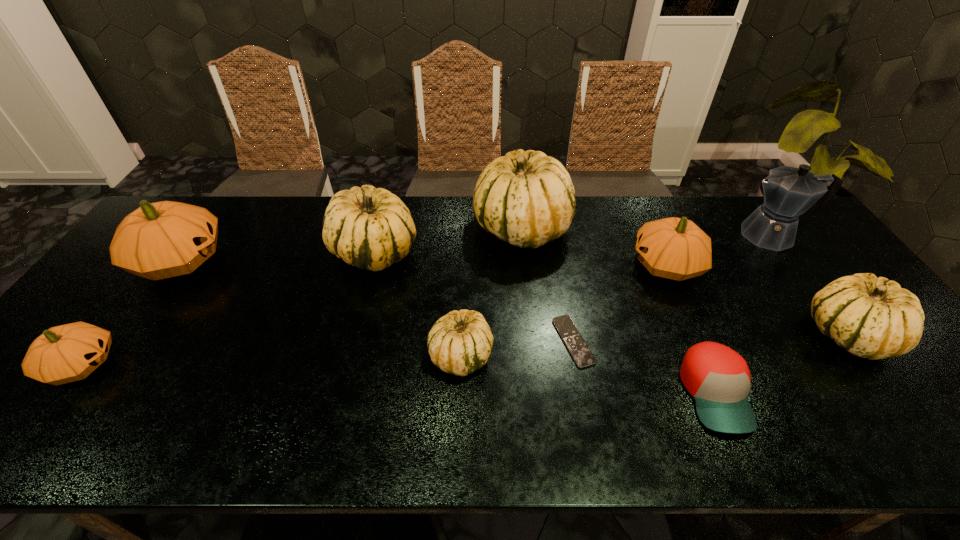
This screenshot has height=540, width=960. I want to click on the smallest white gourd, so point(459,343).

Where is `red baseball cap`? This screenshot has width=960, height=540. red baseball cap is located at coordinates (718, 378).

Locate an element on the screen. The height and width of the screenshot is (540, 960). the ninth tallest object is located at coordinates (718, 378).

The image size is (960, 540). In order to click on the shortest object in this screenshot , I will do `click(580, 352)`.

Find the location of `vacant space located 0.330m on the right of the biggest white gourd`. vacant space located 0.330m on the right of the biggest white gourd is located at coordinates (672, 227).

At what (x,y) coordinates should I click in order to perform the action: click on vacant space located at the spout of the coffeepot. Please return your answer as a coordinate pair (x, y). The image size is (960, 540). Looking at the image, I should click on (701, 235).

Where is `vacant area located at the spout of the coffeepot`? Image resolution: width=960 pixels, height=540 pixels. vacant area located at the spout of the coffeepot is located at coordinates (657, 235).

You are a GUI agent. You are given a task and a screenshot of the screen. Output one action in this format:
    pyautogui.click(x=<x>, y=<y>)
    Task: Click on the vacant space located 0.210m at the spout of the coffeepot
    This screenshot has width=960, height=540.
    Given the screenshot: What is the action you would take?
    pyautogui.click(x=669, y=235)

What are the coordinates of `free location located 0.350m on the side of the biggest orange gourd with the carved face` in the screenshot? It's located at (343, 261).

Where is `free space located on the right of the third object from left to right`? This screenshot has width=960, height=540. free space located on the right of the third object from left to right is located at coordinates (504, 251).